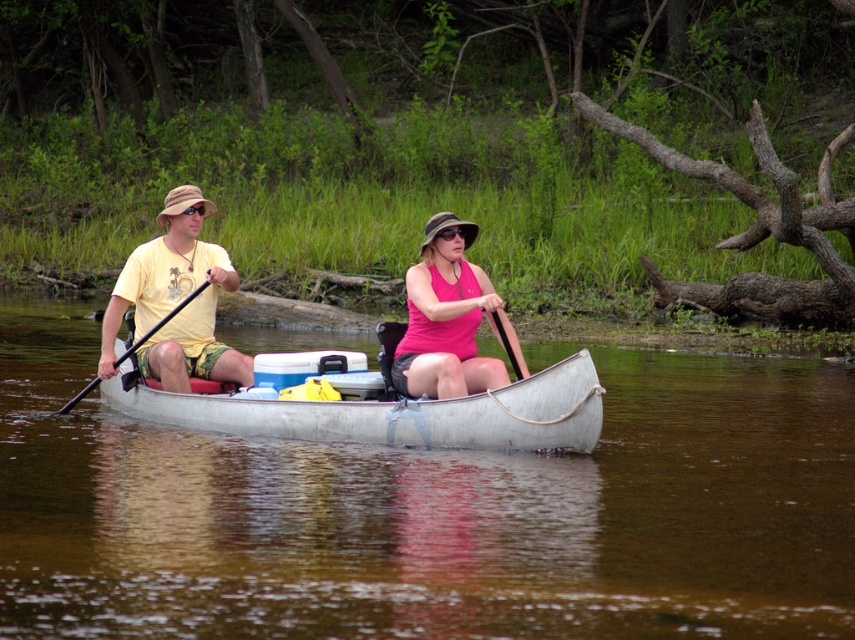
You are standing on the dock and see the white matte canoe at center and the black plastic paddle at left. Which object is taller?

The black plastic paddle at left is taller than the white matte canoe at center.

You are standing on the shore and see the white matte canoe at center and the black plastic paddle at left. Which object is closer to you?

The white matte canoe at center is closer to you since it is in front of the black plastic paddle at left.

You are a photographer trying to capture the matte yellow t shirt at left in the center of your photo. Given that the camera frame is centered at point 0.5, 0.5, and the matte yellow t shirt at left is at point (175,300), will the matte yellow t shirt at left appear centered in your photo?

The matte yellow t shirt at left is located at point (175,300), which is slightly to the left and lower than the center point of the photo frame at 0.5, 0.5. Therefore, the matte yellow t shirt at left will not appear centered in the photo.